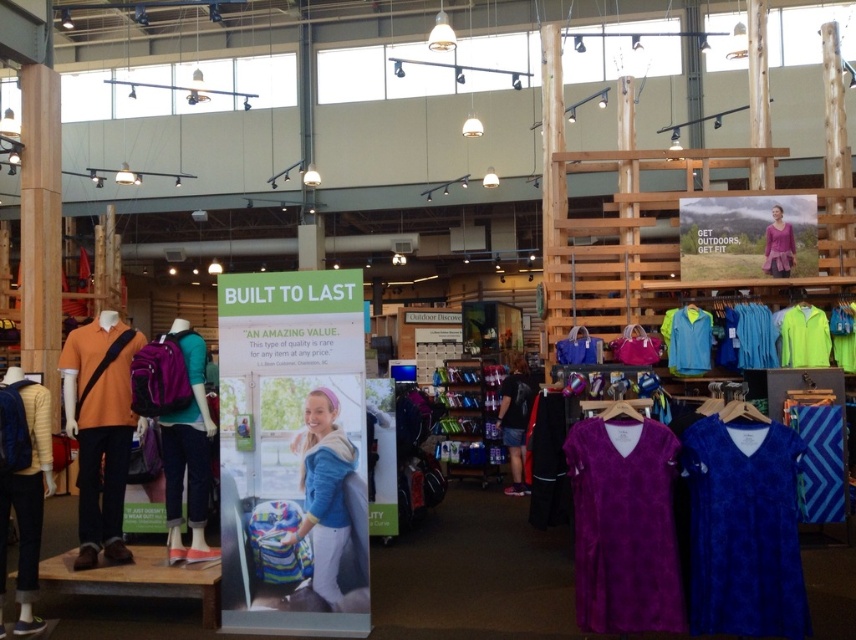
Consider the image. You are a customer standing at the entrance of the store and see the orange matte polo shirt at left. Can you reach it without moving closer?

The orange matte polo shirt at left is 6.05 meters from the camera, which is quite far. Unless you have an exceptionally long reach, you would need to move closer to grab it.

You are standing at the entrance of the store and see two points marked in the image. The first point is at coordinate point [629,506] and the second point is at coordinate point [455,438]. Which point is closer to you?

Point [629,506] is in front of point [455,438], so the first point is closer to you.

You are a customer in the store and want to know if the purple fabric backpack at center can be placed on top of the striped yellow sweater at left without falling over. Based on their heights, is this possible?

The purple fabric backpack at center is taller than the striped yellow sweater at left, so placing it on top might cause instability since the backpack is taller. It is not advisable to stack them this way.